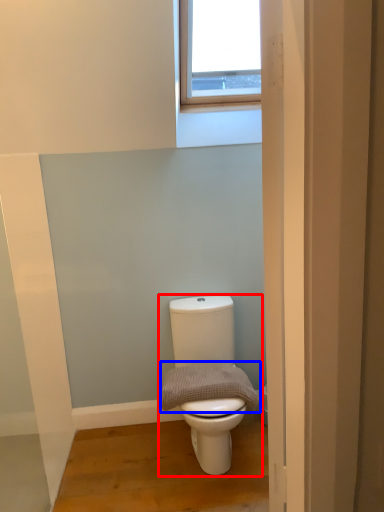
Question: Which point is closer to the camera, toilet (highlighted by a red box) or gray (highlighted by a blue box)?

Choices:
 (A) toilet
 (B) gray

Answer: (A)